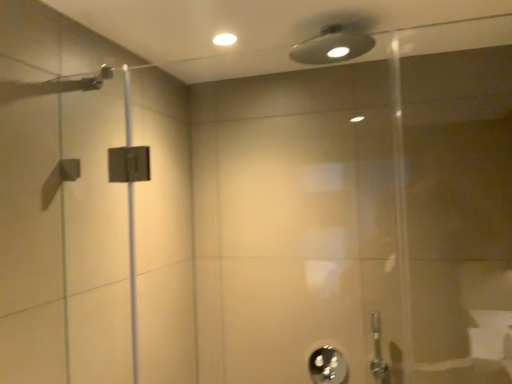
What is the approximate height of polished chrome showerhead at lower right?

It is 18.68 centimeters.

What do you see at coordinates (328, 366) in the screenshot? I see `polished chrome showerhead at lower right` at bounding box center [328, 366].

This screenshot has width=512, height=384. Find the location of `polished chrome showerhead at lower right`. polished chrome showerhead at lower right is located at coordinates (328, 366).

This screenshot has height=384, width=512. I want to click on polished chrome showerhead at lower right, so click(328, 366).